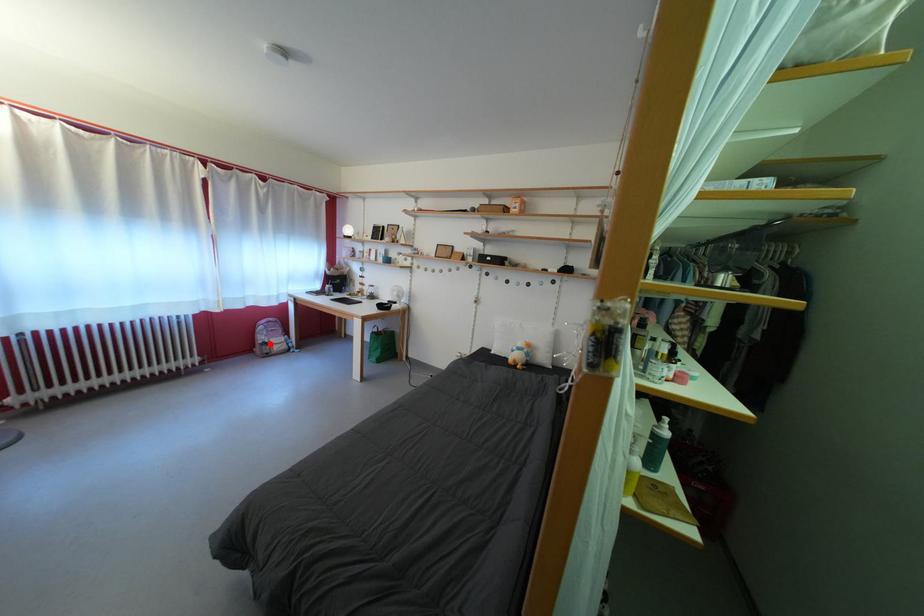
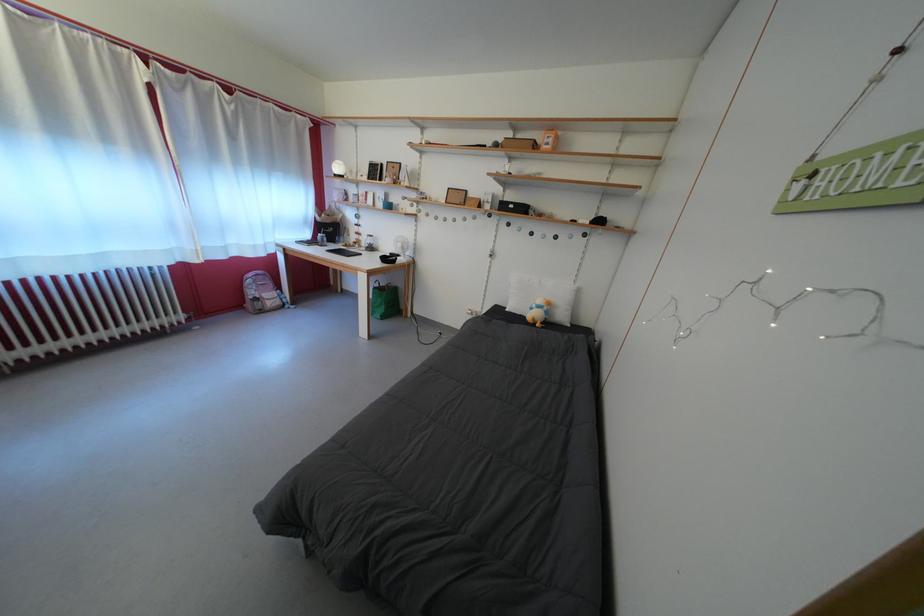
Locate, in the second image, the point that corresponds to the highlighted location in the first image.

(261, 299)